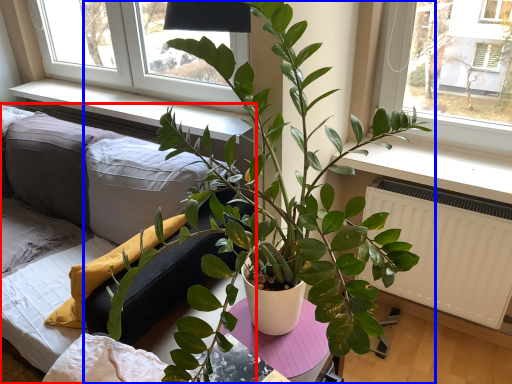
Question: Which object is closer to the camera taking this photo, studio couch (highlighted by a red box) or houseplant (highlighted by a blue box)?

Choices:
 (A) studio couch
 (B) houseplant

Answer: (B)